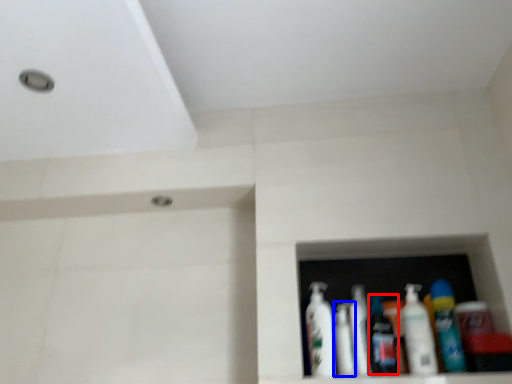
Question: Which point is closer to the camera, toiletry (highlighted by a red box) or mouthwash (highlighted by a blue box)?

Choices:
 (A) toiletry
 (B) mouthwash

Answer: (A)